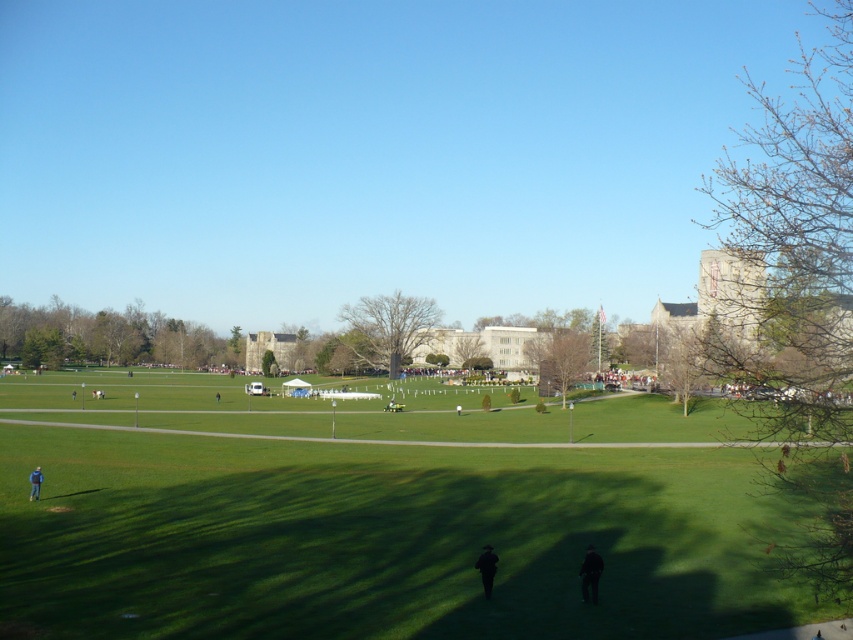
Question: Is bare branches at right thinner than brown leafy tree at center?

Choices:
 (A) no
 (B) yes

Answer: (A)

Question: Which object is the closest to the brown leafy tree at center?

Choices:
 (A) dark gray uniform at lower center
 (B) smooth brown tree at center
 (C) blue fabric jacket at lower left

Answer: (B)

Question: Which point appears closest to the camera in this image?

Choices:
 (A) (397, 314)
 (B) (35, 467)
 (C) (593, 602)

Answer: (C)

Question: Is smooth brown tree at center to the right of dark green fabric at lower center from the viewer's perspective?

Choices:
 (A) yes
 (B) no

Answer: (B)

Question: Which point appears farthest from the camera in this image?

Choices:
 (A) (490, 548)
 (B) (585, 596)

Answer: (B)

Question: Is brown leafy tree at center positioned before dark gray uniform at lower center?

Choices:
 (A) no
 (B) yes

Answer: (A)